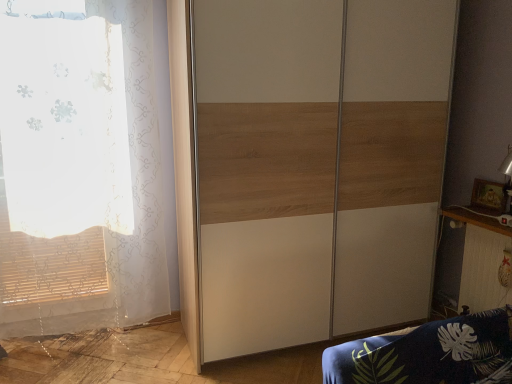
The width and height of the screenshot is (512, 384). In order to click on free spot below white sheer curtain at left (from a real-world perspective) in this screenshot , I will do `click(81, 339)`.